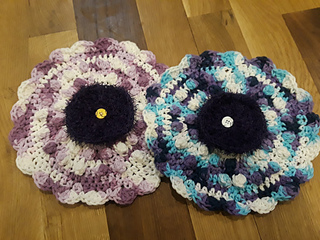
Where is `purple fabric`? purple fabric is located at coordinates (190, 161).